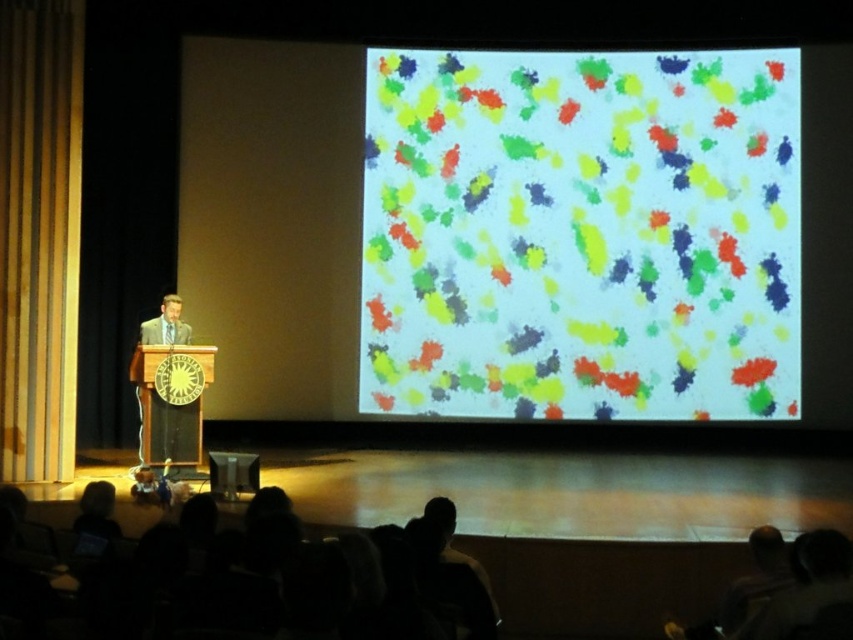
You are an artist who wants to recreate the colorful paint splatters at center from the image. Where exactly should you place them on your canvas?

You should place the colorful paint splatters at center at point [581,234] on your canvas.

You are an attendee sitting in the front row of the lecture hall. You notice a person on stage. Where exactly is the dark hair at lower center located in terms of coordinates?

The dark hair at lower center is located at point coordinates of (276, 577).

In the scene shown: You are a stagehand who needs to move a 5 meter long ladder from the backstage to the stage. The ladder must be carried horizontally. Is there enough space between the dark hair at lower center and the wooden at left to move the ladder without tilting it?

The distance between the dark hair at lower center and the wooden at left is 4.82 meters, which is slightly shorter than the 5 meter ladder. Therefore, the ladder cannot be moved horizontally between them without tilting it.